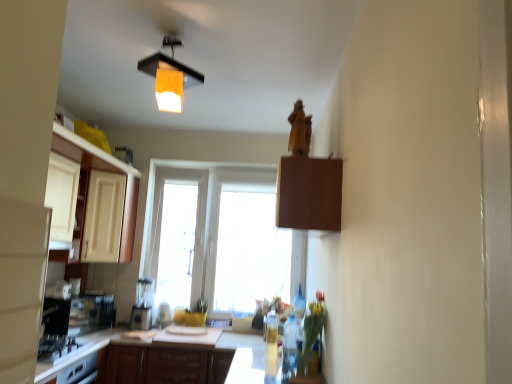
Question: Is the position of wooden panel at upper center more distant than that of translucent glass vase at lower center?

Choices:
 (A) no
 (B) yes

Answer: (A)

Question: From a real-world perspective, is wooden panel at upper center beneath translucent glass vase at lower center?

Choices:
 (A) no
 (B) yes

Answer: (A)

Question: From the image's perspective, does wooden panel at upper center appear lower than translucent glass vase at lower center?

Choices:
 (A) no
 (B) yes

Answer: (A)

Question: Is wooden panel at upper center smaller than translucent glass vase at lower center?

Choices:
 (A) no
 (B) yes

Answer: (A)

Question: From the image's perspective, is wooden panel at upper center over translucent glass vase at lower center?

Choices:
 (A) no
 (B) yes

Answer: (B)

Question: Based on their sizes in the image, would you say translucent glass vase at lower center is bigger or smaller than wooden cabinet at center, the 2th cabinetry positioned from the left?

Choices:
 (A) small
 (B) big

Answer: (A)

Question: In terms of width, does translucent glass vase at lower center look wider or thinner when compared to wooden cabinet at center, which ranks as the 2th cabinetry in back-to-front order?

Choices:
 (A) wide
 (B) thin

Answer: (B)

Question: From the image's perspective, is translucent glass vase at lower center above or below wooden cabinet at center, marked as the 2th cabinetry in a right-to-left arrangement?

Choices:
 (A) below
 (B) above

Answer: (B)

Question: Would you say translucent glass vase at lower center is to the left or to the right of wooden cabinet at center, which ranks as the 2th cabinetry in back-to-front order, in the picture?

Choices:
 (A) right
 (B) left

Answer: (A)

Question: Considering the positions of point (137, 291) and point (303, 345), is point (137, 291) closer or farther from the camera than point (303, 345)?

Choices:
 (A) closer
 (B) farther

Answer: (B)

Question: From a real-world perspective, is matte white blender at center physically located above or below translucent glass vase at lower center?

Choices:
 (A) above
 (B) below

Answer: (B)

Question: Would you say matte white blender at center is to the left or to the right of translucent glass vase at lower center in the picture?

Choices:
 (A) right
 (B) left

Answer: (B)

Question: Relative to translucent glass vase at lower center, is matte white blender at center in front or behind?

Choices:
 (A) behind
 (B) front

Answer: (A)

Question: From a real-world perspective, relative to translucent plastic bottle at center, acting as the 2th bottle starting from the front, is wooden panel at upper center vertically above or below?

Choices:
 (A) above
 (B) below

Answer: (A)

Question: In terms of size, does wooden panel at upper center appear bigger or smaller than translucent plastic bottle at center, acting as the 2th bottle starting from the front?

Choices:
 (A) big
 (B) small

Answer: (A)